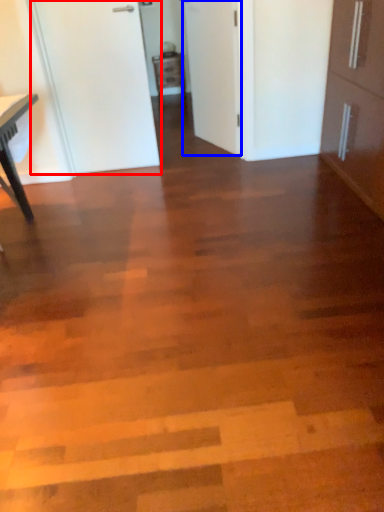
Question: Which object is closer to the camera taking this photo, door (highlighted by a red box) or door (highlighted by a blue box)?

Choices:
 (A) door
 (B) door

Answer: (A)